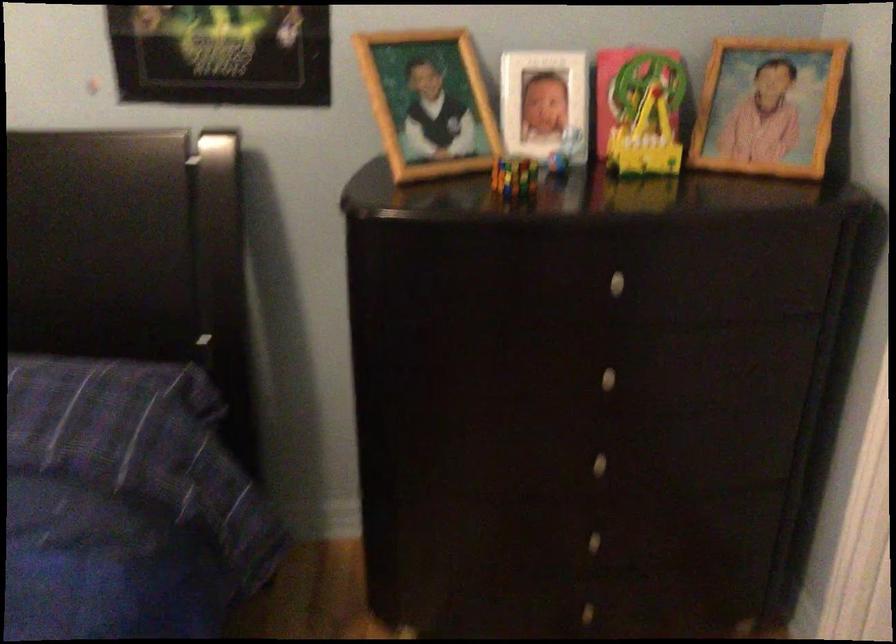
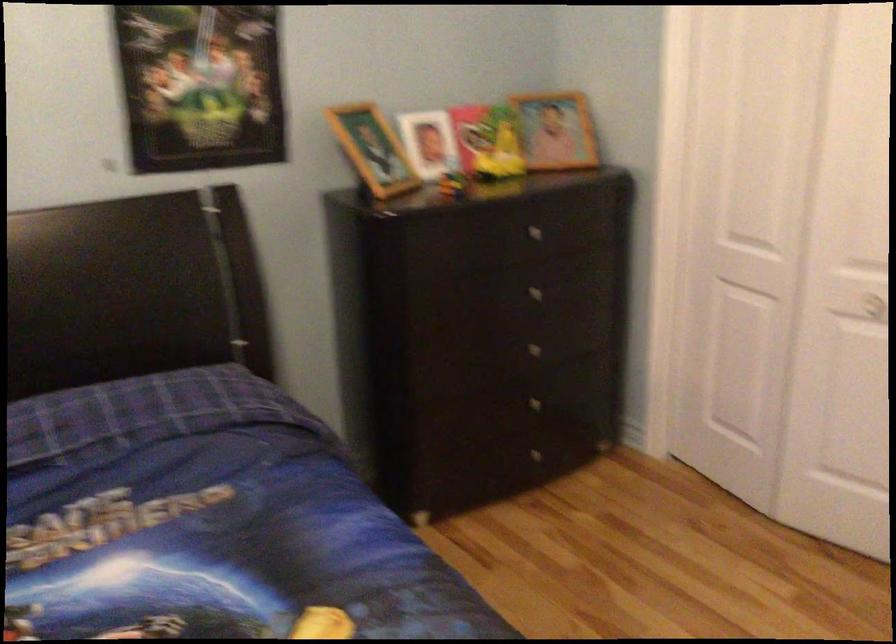
Locate, in the second image, the point that corresponds to (615,466) in the first image.

(539, 353)